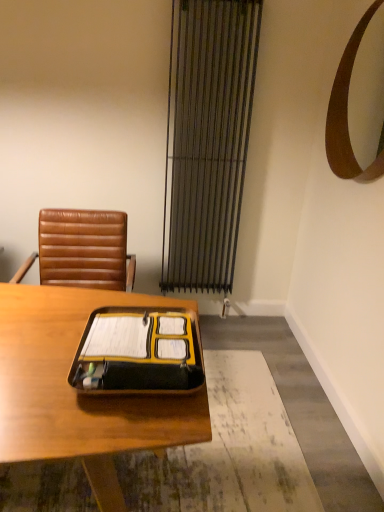
In order to face yellow matte folder at center, should I rotate leftwards or rightwards?

A 6.636 degree turn to the left will do.

Locate an element on the screen. metallic silver curtain at center is located at coordinates [x=207, y=139].

Which is more to the right, yellow matte folder at center or brown leather chair at upper left?

Positioned to the right is yellow matte folder at center.

From a real-world perspective, which is physically above, yellow matte folder at center or brown leather chair at upper left?

yellow matte folder at center, from a real-world perspective.

Does yellow matte folder at center have a greater width compared to brown leather chair at upper left?

In fact, yellow matte folder at center might be narrower than brown leather chair at upper left.

Locate an element on the screen. This screenshot has height=512, width=384. notebook that is in front of the brown leather chair at upper left is located at coordinates (138, 352).

Is brown leather chair at upper left bigger than metallic silver curtain at center?

Correct, brown leather chair at upper left is larger in size than metallic silver curtain at center.

Based on the photo, is brown leather chair at upper left wider or thinner than metallic silver curtain at center?

Considering their sizes, brown leather chair at upper left looks broader than metallic silver curtain at center.

Measure the distance from brown leather chair at upper left to metallic silver curtain at center.

A distance of 80.68 centimeters exists between brown leather chair at upper left and metallic silver curtain at center.

Does brown leather chair at upper left have a greater height compared to metallic silver curtain at center?

Incorrect, the height of brown leather chair at upper left is not larger of that of metallic silver curtain at center.

Is point (177, 230) closer to viewer compared to point (202, 411)?

No.

From the image's perspective, does metallic silver curtain at center appear lower than wooden desk at center?

No.

Is metallic silver curtain at center not inside wooden desk at center?

Yes.

Is metallic silver curtain at center with wooden desk at center?

metallic silver curtain at center is not next to wooden desk at center, and they're not touching.

Is point (49, 244) positioned behind point (152, 374)?

Yes, it is.

From the picture: Is brown leather chair at upper left far from yellow matte folder at center?

brown leather chair at upper left is far away from yellow matte folder at center.

From the picture: Considering the sizes of objects brown leather chair at upper left and yellow matte folder at center in the image provided, who is shorter, brown leather chair at upper left or yellow matte folder at center?

yellow matte folder at center.

Relative to yellow matte folder at center, is brown leather chair at upper left in front or behind?

Clearly, brown leather chair at upper left is behind yellow matte folder at center.

Is point (138, 338) positioned in front of point (81, 326)?

Yes, it is in front of point (81, 326).

Looking at this image, between yellow matte folder at center and wooden desk at center, which one has smaller size?

Smaller between the two is yellow matte folder at center.

Is yellow matte folder at center facing away from wooden desk at center?

yellow matte folder at center does not have its back to wooden desk at center.

Image resolution: width=384 pixels, height=512 pixels. Find the location of `mirror above the yellow matte folder at center (from a real-world perspective)`. mirror above the yellow matte folder at center (from a real-world perspective) is located at coordinates (347, 114).

Which object is thinner, yellow matte folder at center or brown wooden mirror at upper right?

Thinner between the two is brown wooden mirror at upper right.

Which is nearer, (x=143, y=387) or (x=352, y=167)?

Point (x=143, y=387) is positioned closer to the camera compared to point (x=352, y=167).

Would you say yellow matte folder at center is outside brown wooden mirror at upper right?

Yes, yellow matte folder at center is located beyond the bounds of brown wooden mirror at upper right.

Which object is more forward, brown wooden mirror at upper right or brown leather chair at upper left?

brown wooden mirror at upper right.

Can you confirm if brown wooden mirror at upper right is positioned to the left of brown leather chair at upper left?

In fact, brown wooden mirror at upper right is to the right of brown leather chair at upper left.

Considering the positions of point (334, 170) and point (87, 231), is point (334, 170) closer or farther from the camera than point (87, 231)?

Point (334, 170) is positioned farther from the camera compared to point (87, 231).

The height and width of the screenshot is (512, 384). What are the coordinates of `notebook in front of the brown leather chair at upper left` in the screenshot? It's located at (138, 352).

You are a GUI agent. You are given a task and a screenshot of the screen. Output one action in this format:
    pyautogui.click(x=<x>, y=<y>)
    Task: Click on the chair on the left side of metallic silver curtain at center
    
    Given the screenshot: What is the action you would take?
    pyautogui.click(x=82, y=250)

Estimate the real-world distances between objects in this image. Which object is closer to yellow matte folder at center, brown leather chair at upper left or wooden desk at center?

wooden desk at center is closer to yellow matte folder at center.

When comparing their distances from wooden desk at center, does brown leather chair at upper left or yellow matte folder at center seem closer?

yellow matte folder at center is positioned closer to the anchor wooden desk at center.

When comparing their distances from metallic silver curtain at center, does brown leather chair at upper left or wooden desk at center seem further?

wooden desk at center is positioned further to the anchor metallic silver curtain at center.

Estimate the real-world distances between objects in this image. Which object is closer to metallic silver curtain at center, brown leather chair at upper left or brown wooden mirror at upper right?

brown wooden mirror at upper right lies closer to metallic silver curtain at center than the other object.

Considering their positions, is brown wooden mirror at upper right positioned further to yellow matte folder at center than metallic silver curtain at center?

metallic silver curtain at center is positioned further to the anchor yellow matte folder at center.

When comparing their distances from metallic silver curtain at center, does brown leather chair at upper left or yellow matte folder at center seem closer?

brown leather chair at upper left lies closer to metallic silver curtain at center than the other object.

Consider the image. Looking at the image, which one is located closer to yellow matte folder at center, brown wooden mirror at upper right or wooden desk at center?

wooden desk at center is positioned closer to the anchor yellow matte folder at center.

From the image, which object appears to be farther from wooden desk at center, brown leather chair at upper left or brown wooden mirror at upper right?

The object further to wooden desk at center is brown wooden mirror at upper right.

Locate an element on the screen. chair between yellow matte folder at center and metallic silver curtain at center along the z-axis is located at coordinates (82, 250).

Where is `notebook between wooden desk at center and brown leather chair at upper left along the z-axis`? This screenshot has width=384, height=512. notebook between wooden desk at center and brown leather chair at upper left along the z-axis is located at coordinates (138, 352).

This screenshot has height=512, width=384. Identify the location of notebook between wooden desk at center and metallic silver curtain at center in the front-back direction. (138, 352).

You are a GUI agent. You are given a task and a screenshot of the screen. Output one action in this format:
    pyautogui.click(x=<x>, y=<y>)
    Task: Click on the curtain between brown wooden mirror at upper right and wooden desk at center in the vertical direction
    Image resolution: width=384 pixels, height=512 pixels.
    Given the screenshot: What is the action you would take?
    pyautogui.click(x=207, y=139)